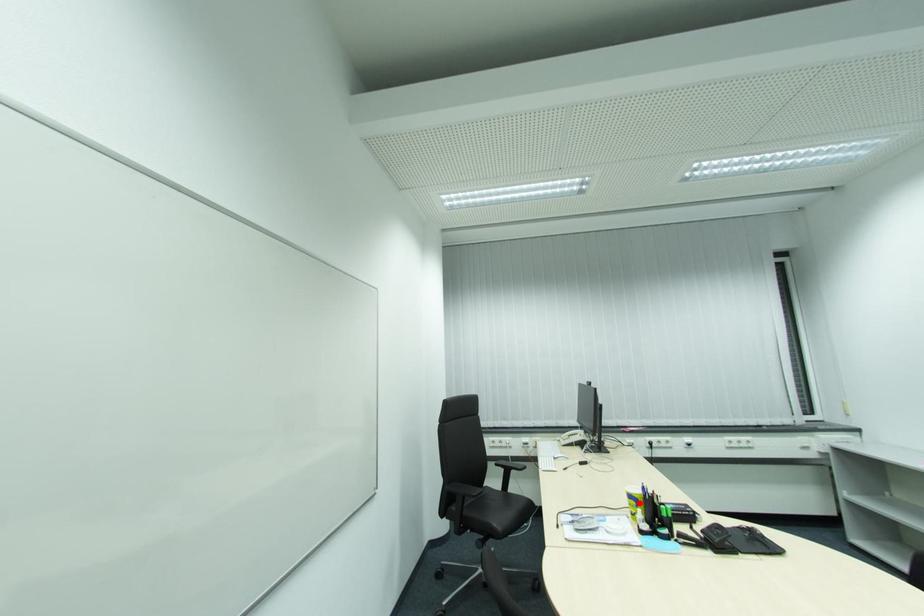
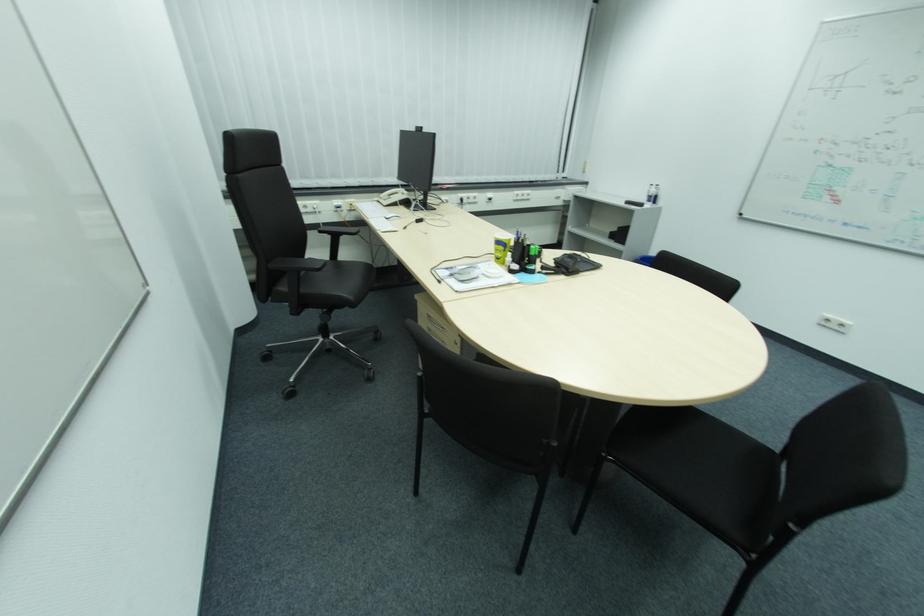
Find the pixel in the second image that matches the highlighted location in the first image.

(507, 248)